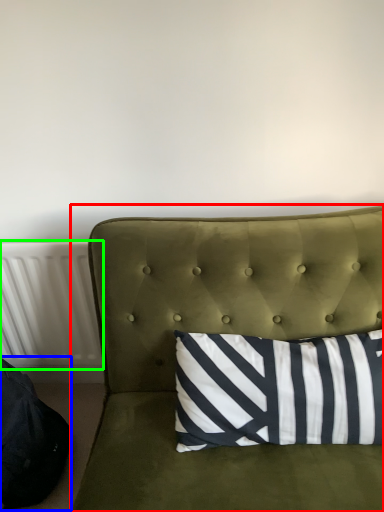
Question: Which is farther away from studio couch (highlighted by a red box)? bean bag chair (highlighted by a blue box) or radiator (highlighted by a green box)?

Choices:
 (A) bean bag chair
 (B) radiator

Answer: (A)